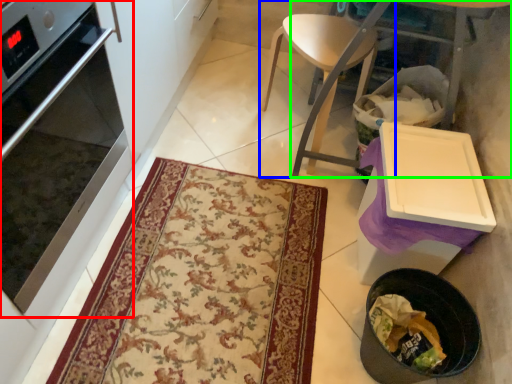
Question: Estimate the real-world distances between objects in this image. Which object is farther from oven (highlighted by a red box), chair (highlighted by a blue box) or table (highlighted by a green box)?

Choices:
 (A) chair
 (B) table

Answer: (B)